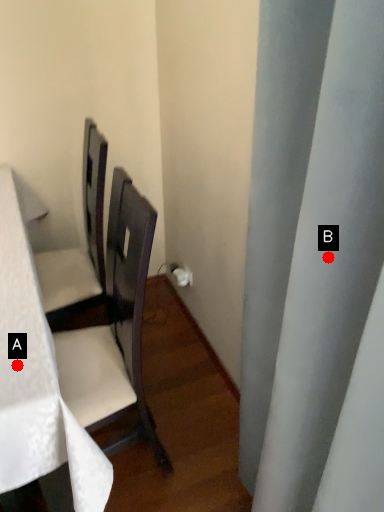
Question: Two points are circled on the image, labeled by A and B beside each circle. Which point is farther from the camera taking this photo?

Choices:
 (A) A is further
 (B) B is further

Answer: (A)